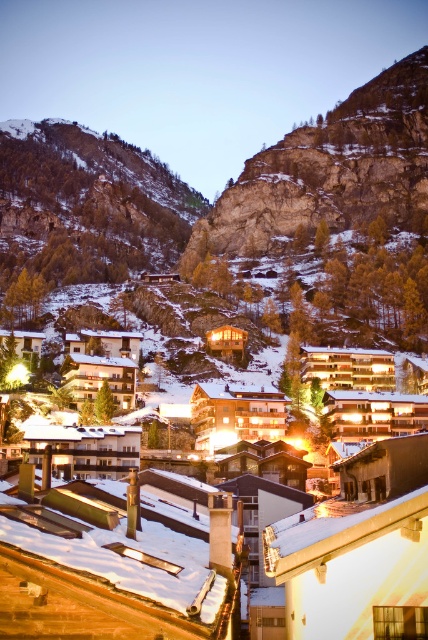
Question: Which point appears farthest from the camera in this image?

Choices:
 (A) (326, 188)
 (B) (162, 252)

Answer: (B)

Question: Which point is closer to the camera taking this photo?

Choices:
 (A) (80, 212)
 (B) (354, 202)

Answer: (B)

Question: Does snowy rocky cliff at upper left appear under rocky cliff at upper center?

Choices:
 (A) no
 (B) yes

Answer: (B)

Question: Which point appears farthest from the camera in this image?

Choices:
 (A) (290, 138)
 (B) (48, 232)

Answer: (B)

Question: Is snowy rocky cliff at upper left above rocky cliff at upper center?

Choices:
 (A) no
 (B) yes

Answer: (A)

Question: Does snowy rocky cliff at upper left have a lesser width compared to rocky cliff at upper center?

Choices:
 (A) no
 (B) yes

Answer: (A)